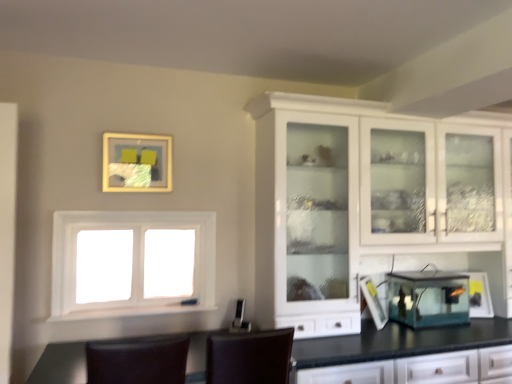
What do you see at coordinates (479, 295) in the screenshot? I see `transparent glass lantern at lower right, which ranks as the second appliance in left-to-right order` at bounding box center [479, 295].

The width and height of the screenshot is (512, 384). Describe the element at coordinates (249, 357) in the screenshot. I see `brown leather chair at center, which is counted as the first chair, starting from the right` at that location.

What is the approximate height of transparent glass fish tank at center, which is counted as the 1th appliance, starting from the left?

transparent glass fish tank at center, which is counted as the 1th appliance, starting from the left, is 11.08 inches in height.

Image resolution: width=512 pixels, height=384 pixels. In order to click on white matte window at center in this screenshot , I will do pos(131,263).

The image size is (512, 384). What do you see at coordinates (138, 360) in the screenshot?
I see `brown leather chair at lower center, the first chair from the left` at bounding box center [138, 360].

Locate an element on the screen. Image resolution: width=512 pixels, height=384 pixels. transparent glass lantern at lower right, which ranks as the second appliance in left-to-right order is located at coordinates (479, 295).

Is transparent glass fish tank at center, which is counted as the 1th appliance, starting from the left, far from white matte window at center?

That's right, there is a large distance between transparent glass fish tank at center, which is counted as the 1th appliance, starting from the left, and white matte window at center.

Does transparent glass fish tank at center, which is counted as the 1th appliance, starting from the left, have a larger size compared to white matte window at center?

Incorrect, transparent glass fish tank at center, which is counted as the 1th appliance, starting from the left, is not larger than white matte window at center.

Which object is positioned more to the left, transparent glass fish tank at center, which is the second appliance in right-to-left order, or white matte window at center?

white matte window at center.

Is transparent glass fish tank at center, which is counted as the 1th appliance, starting from the left, looking in the opposite direction of white matte window at center?

No, transparent glass fish tank at center, which is counted as the 1th appliance, starting from the left,'s orientation is not away from white matte window at center.

From the image's perspective, is white glossy cabinet at upper right beneath matte gold picture frame at upper center?

Yes, from the image's perspective, white glossy cabinet at upper right is beneath matte gold picture frame at upper center.

Is matte gold picture frame at upper center located within white glossy cabinet at upper right?

No, matte gold picture frame at upper center is located outside of white glossy cabinet at upper right.

Is white glossy cabinet at upper right smaller than matte gold picture frame at upper center?

Actually, white glossy cabinet at upper right might be larger than matte gold picture frame at upper center.

Is point (302, 154) in front of point (126, 152)?

That is False.

Considering the positions of point (101, 262) and point (484, 272), is point (101, 262) closer or farther from the camera than point (484, 272)?

Clearly, point (101, 262) is closer to the camera than point (484, 272).

How many degrees apart are the facing directions of white matte window at center and transparent glass lantern at lower right, the first appliance in the right-to-left sequence?

24.4 degrees separate the facing orientations of white matte window at center and transparent glass lantern at lower right, the first appliance in the right-to-left sequence.

Does white matte window at center appear on the left side of transparent glass lantern at lower right, which ranks as the second appliance in left-to-right order?

Yes.

Is white matte window at center facing away from transparent glass lantern at lower right, which ranks as the second appliance in left-to-right order?

No, transparent glass lantern at lower right, which ranks as the second appliance in left-to-right order, is not at the back of white matte window at center.

Considering their positions, is transparent glass fish tank at center, which is counted as the 1th appliance, starting from the left, located in front of or behind transparent glass lantern at lower right, the first appliance in the right-to-left sequence?

Clearly, transparent glass fish tank at center, which is counted as the 1th appliance, starting from the left, is in front of transparent glass lantern at lower right, the first appliance in the right-to-left sequence.

Visually, is transparent glass fish tank at center, which is counted as the 1th appliance, starting from the left, positioned to the left or to the right of transparent glass lantern at lower right, which ranks as the second appliance in left-to-right order?

transparent glass fish tank at center, which is counted as the 1th appliance, starting from the left, is positioned on transparent glass lantern at lower right, which ranks as the second appliance in left-to-right order,'s left side.

Is there a large distance between transparent glass fish tank at center, which is counted as the 1th appliance, starting from the left, and transparent glass lantern at lower right, which ranks as the second appliance in left-to-right order?

They are positioned close to each other.

From the image's perspective, is transparent glass fish tank at center, which is counted as the 1th appliance, starting from the left, above or below transparent glass lantern at lower right, the first appliance in the right-to-left sequence?

Clearly, from the image's perspective, transparent glass fish tank at center, which is counted as the 1th appliance, starting from the left, is above transparent glass lantern at lower right, the first appliance in the right-to-left sequence.

Does white matte window at center have a lesser width compared to matte gold picture frame at upper center?

No.

Would you consider white matte window at center to be distant from matte gold picture frame at upper center?

No, white matte window at center is not far from matte gold picture frame at upper center.

Visually, is white matte window at center positioned to the left or to the right of matte gold picture frame at upper center?

white matte window at center is positioned on matte gold picture frame at upper center's right side.

From the image's perspective, is white matte window at center over matte gold picture frame at upper center?

No, from the image's perspective, white matte window at center is not above matte gold picture frame at upper center.

Is matte gold picture frame at upper center beside brown leather chair at center, which is counted as the first chair, starting from the right?

No.

Consider the image. From the image's perspective, would you say matte gold picture frame at upper center is positioned over brown leather chair at center, which is counted as the first chair, starting from the right?

Yes, from the image's perspective, matte gold picture frame at upper center is on top of brown leather chair at center, which is counted as the first chair, starting from the right.

What's the angular difference between matte gold picture frame at upper center and brown leather chair at center, the 2th chair when ordered from left to right,'s facing directions?

178 degrees.

Considering their positions, is matte gold picture frame at upper center located in front of or behind brown leather chair at center, which is counted as the first chair, starting from the right?

In the image, matte gold picture frame at upper center appears behind brown leather chair at center, which is counted as the first chair, starting from the right.

In the scene shown: From a real-world perspective, who is located lower, brown leather chair at lower center, the 2th chair when ordered from right to left, or transparent glass fish tank at center, which is the second appliance in right-to-left order?

In real-world perspective, brown leather chair at lower center, the 2th chair when ordered from right to left, is lower.

Is point (177, 342) closer or farther from the camera than point (437, 294)?

Point (177, 342) is closer to the camera than point (437, 294).

Can you confirm if brown leather chair at lower center, the 2th chair when ordered from right to left, is smaller than transparent glass fish tank at center, which is the second appliance in right-to-left order?

No.

Where is `window located above the transparent glass fish tank at center, which is counted as the 1th appliance, starting from the left (from a real-world perspective)`? The image size is (512, 384). window located above the transparent glass fish tank at center, which is counted as the 1th appliance, starting from the left (from a real-world perspective) is located at coordinates (131, 263).

At what (x,y) coordinates should I click in order to perform the action: click on cabinetry located on the right of matte gold picture frame at upper center. Please return your answer as a coordinate pair (x, y). The height and width of the screenshot is (384, 512). Looking at the image, I should click on (371, 203).

From the picture: Considering their positions, is white glossy cabinet at upper right positioned closer to white matte window at center than matte gold picture frame at upper center?

Based on the image, matte gold picture frame at upper center appears to be nearer to white matte window at center.

Estimate the real-world distances between objects in this image. Which object is closer to transparent glass lantern at lower right, which ranks as the second appliance in left-to-right order, white matte window at center or white glossy cabinet at upper right?

white glossy cabinet at upper right is positioned closer to the anchor transparent glass lantern at lower right, which ranks as the second appliance in left-to-right order.

Based on their spatial positions, is brown leather chair at lower center, the first chair from the left, or brown leather chair at center, the 2th chair when ordered from left to right, further from transparent glass fish tank at center, which is counted as the 1th appliance, starting from the left?

brown leather chair at lower center, the first chair from the left, is further to transparent glass fish tank at center, which is counted as the 1th appliance, starting from the left.

Looking at the image, which one is located closer to white matte window at center, transparent glass lantern at lower right, the first appliance in the right-to-left sequence, or brown leather chair at center, the 2th chair when ordered from left to right?

The object closer to white matte window at center is brown leather chair at center, the 2th chair when ordered from left to right.

From the image, which object appears to be nearer to white matte window at center, transparent glass fish tank at center, which is counted as the 1th appliance, starting from the left, or brown leather chair at center, which is counted as the first chair, starting from the right?

Based on the image, brown leather chair at center, which is counted as the first chair, starting from the right, appears to be nearer to white matte window at center.

When comparing their distances from brown leather chair at lower center, the 2th chair when ordered from right to left, does white glossy cabinet at upper right or matte gold picture frame at upper center seem closer?

Among the two, matte gold picture frame at upper center is located nearer to brown leather chair at lower center, the 2th chair when ordered from right to left.

Which object lies nearer to the anchor point brown leather chair at center, the 2th chair when ordered from left to right, transparent glass fish tank at center, which is counted as the 1th appliance, starting from the left, or white glossy cabinet at upper right?

white glossy cabinet at upper right lies closer to brown leather chair at center, the 2th chair when ordered from left to right, than the other object.

In the scene shown: When comparing their distances from transparent glass lantern at lower right, which ranks as the second appliance in left-to-right order, does white matte window at center or matte gold picture frame at upper center seem closer?

white matte window at center is positioned closer to the anchor transparent glass lantern at lower right, which ranks as the second appliance in left-to-right order.

Find the location of `cabinetry between brown leather chair at center, the 2th chair when ordered from left to right, and transparent glass fish tank at center, which is counted as the 1th appliance, starting from the left`. cabinetry between brown leather chair at center, the 2th chair when ordered from left to right, and transparent glass fish tank at center, which is counted as the 1th appliance, starting from the left is located at coordinates (371, 203).

Locate an element on the screen. The width and height of the screenshot is (512, 384). appliance between brown leather chair at lower center, the 2th chair when ordered from right to left, and transparent glass lantern at lower right, which ranks as the second appliance in left-to-right order, in the horizontal direction is located at coordinates pos(428,298).

The height and width of the screenshot is (384, 512). What are the coordinates of `window that lies between matte gold picture frame at upper center and brown leather chair at center, which is counted as the first chair, starting from the right, from top to bottom` in the screenshot? It's located at (131, 263).

Where is `cabinetry located between brown leather chair at center, the 2th chair when ordered from left to right, and transparent glass lantern at lower right, the first appliance in the right-to-left sequence, in the left-right direction`? The height and width of the screenshot is (384, 512). cabinetry located between brown leather chair at center, the 2th chair when ordered from left to right, and transparent glass lantern at lower right, the first appliance in the right-to-left sequence, in the left-right direction is located at coordinates (371, 203).